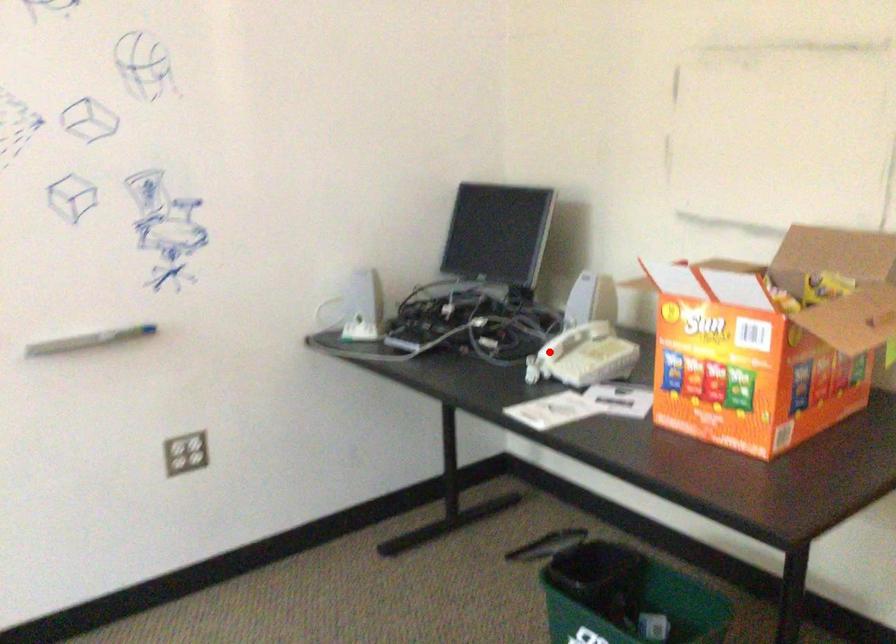
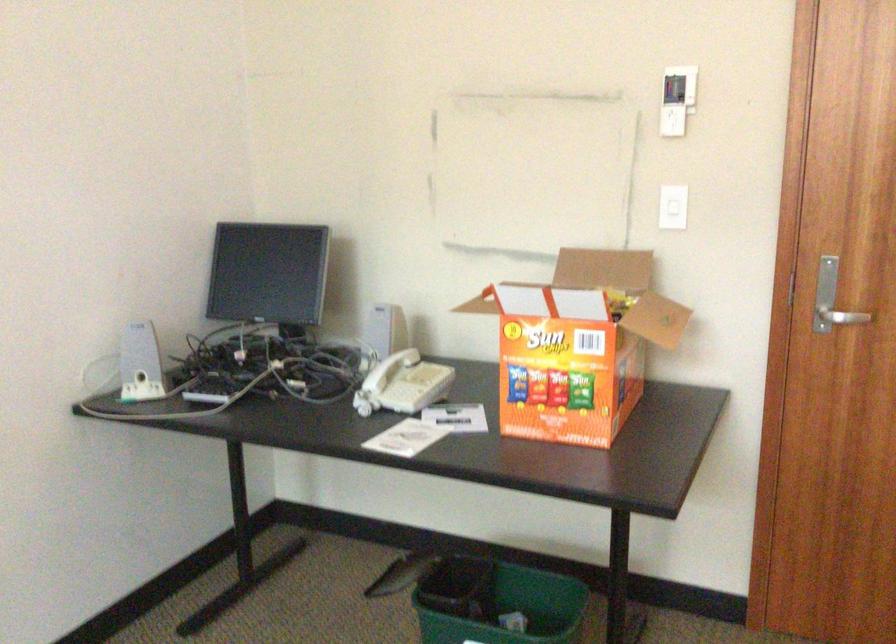
Locate, in the second image, the point that corresponds to the highlighted location in the first image.

(376, 383)